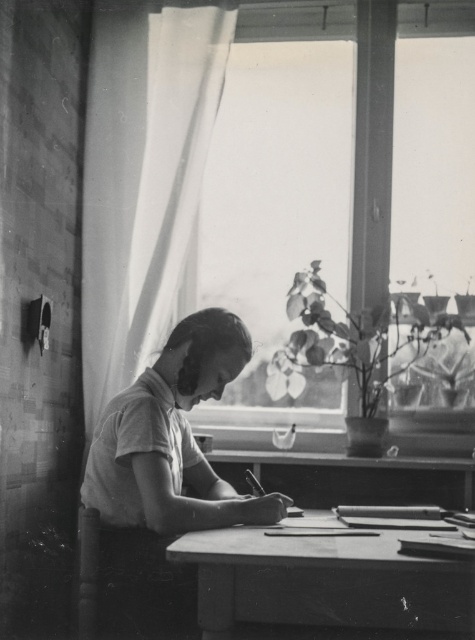
You are a person sitting at the wooden table at center. You want to see outside through the transparent glass window at center. Can you look up or down to see through it?

The transparent glass window at center is above the wooden table at center, so you can look up to see outside through the transparent glass window at center.

Consider the image. You are a tailor who needs to determine if the smooth white shirt at center can be placed on the wooden table at center. Given their sizes, will the shirt fit entirely on the table?

The smooth white shirt at center is bigger than the wooden table at center, so it cannot fit entirely on the table.

You are standing in front of the desk in the image. There are two points marked on the desk at coordinates point (221, 81) and point (203, 346). Which point is closer to you?

Point (203, 346) is closer to you because point (221, 81) is behind it.